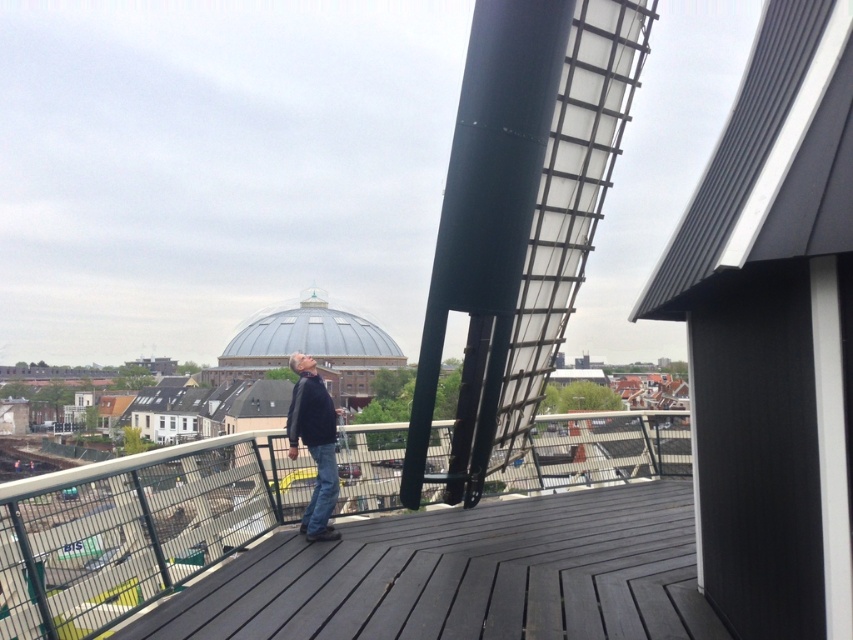
Question: Is dark gray wood deck at center positioned before dark blue jeans at center?

Choices:
 (A) yes
 (B) no

Answer: (A)

Question: Where is dark gray wood deck at center located in relation to dark blue jeans at center in the image?

Choices:
 (A) right
 (B) left

Answer: (A)

Question: Among these objects, which one is nearest to the camera?

Choices:
 (A) dark gray wood deck at center
 (B) dark blue jeans at center

Answer: (A)

Question: Which object is farther from the camera taking this photo?

Choices:
 (A) dark gray wood deck at center
 (B) dark blue jeans at center

Answer: (B)

Question: Does dark gray wood deck at center have a smaller size compared to dark blue jeans at center?

Choices:
 (A) no
 (B) yes

Answer: (B)